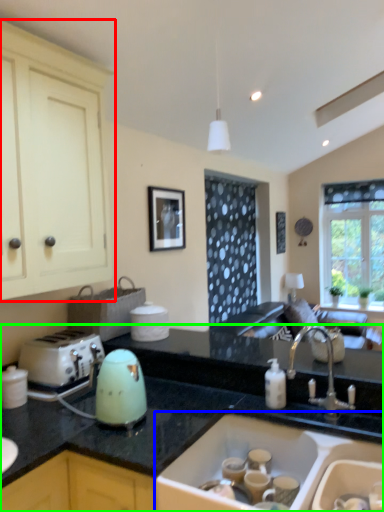
Question: Which object is positioned farthest from cabinetry (highlighted by a red box)? Select from sink (highlighted by a blue box) and countertop (highlighted by a green box).

Choices:
 (A) sink
 (B) countertop

Answer: (A)